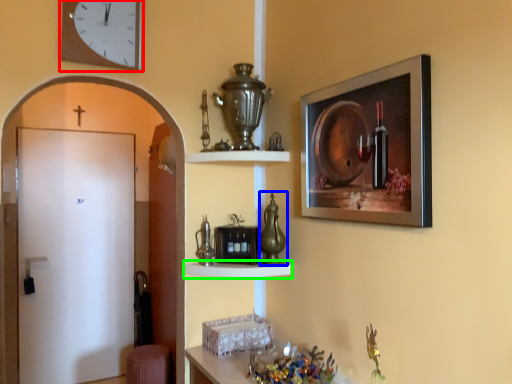
Question: Based on their relative distances, which object is nearer to clock (highlighted by a red box)? Choose from glass vase (highlighted by a blue box) and shelf (highlighted by a green box).

Choices:
 (A) glass vase
 (B) shelf

Answer: (A)